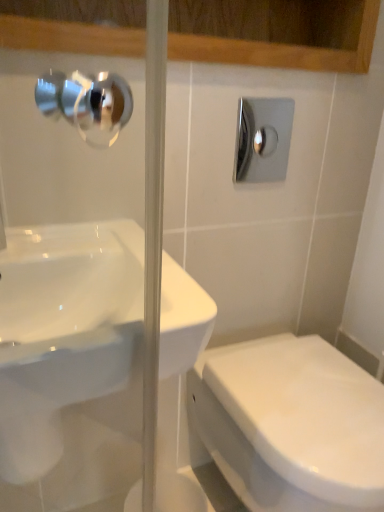
Question: Is white glossy toilet at lower right positioned before white glossy sink at center?

Choices:
 (A) no
 (B) yes

Answer: (A)

Question: Is the position of white glossy toilet at lower right more distant than that of white glossy sink at center?

Choices:
 (A) no
 (B) yes

Answer: (B)

Question: Can you confirm if white glossy toilet at lower right is shorter than white glossy sink at center?

Choices:
 (A) no
 (B) yes

Answer: (A)

Question: Is white glossy sink at center inside white glossy toilet at lower right?

Choices:
 (A) no
 (B) yes

Answer: (A)

Question: From the image's perspective, is white glossy toilet at lower right beneath white glossy sink at center?

Choices:
 (A) yes
 (B) no

Answer: (A)

Question: Is white glossy sink at center inside or outside of polished chrome shower at upper right?

Choices:
 (A) outside
 (B) inside

Answer: (A)

Question: Considering the positions of white glossy sink at center and polished chrome shower at upper right in the image, is white glossy sink at center bigger or smaller than polished chrome shower at upper right?

Choices:
 (A) small
 (B) big

Answer: (B)

Question: From a real-world perspective, is white glossy sink at center positioned above or below polished chrome shower at upper right?

Choices:
 (A) below
 (B) above

Answer: (A)

Question: Considering the positions of white glossy sink at center and polished chrome shower at upper right in the image, is white glossy sink at center taller or shorter than polished chrome shower at upper right?

Choices:
 (A) short
 (B) tall

Answer: (A)

Question: From a real-world perspective, is polished chrome shower at upper right positioned above or below white glossy toilet at lower right?

Choices:
 (A) below
 (B) above

Answer: (B)

Question: Is point (235, 170) closer or farther from the camera than point (223, 404)?

Choices:
 (A) farther
 (B) closer

Answer: (A)

Question: From the image's perspective, is polished chrome shower at upper right above or below white glossy toilet at lower right?

Choices:
 (A) below
 (B) above

Answer: (B)

Question: Is polished chrome shower at upper right wider or thinner than white glossy toilet at lower right?

Choices:
 (A) wide
 (B) thin

Answer: (B)

Question: Visually, is white glossy toilet at lower right positioned to the left or to the right of polished chrome shower at upper right?

Choices:
 (A) left
 (B) right

Answer: (B)

Question: Is white glossy toilet at lower right wider or thinner than polished chrome shower at upper right?

Choices:
 (A) thin
 (B) wide

Answer: (B)